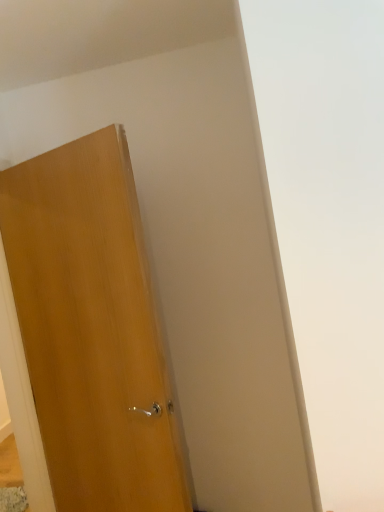
Identify the location of wooden door at left. [x=92, y=328].

The height and width of the screenshot is (512, 384). What do you see at coordinates (92, 328) in the screenshot?
I see `wooden door at left` at bounding box center [92, 328].

Locate an element on the screen. The width and height of the screenshot is (384, 512). wooden door at left is located at coordinates (92, 328).